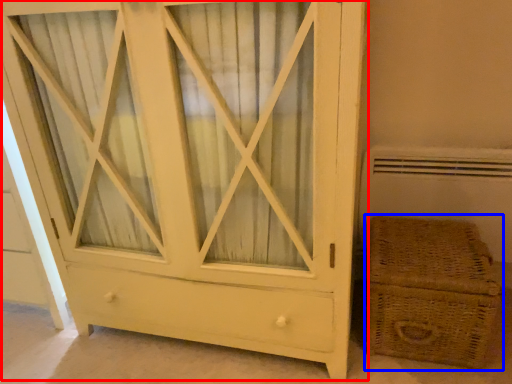
Question: Which point is further to the camera, chest of drawers (highlighted by a red box) or basket (highlighted by a blue box)?

Choices:
 (A) chest of drawers
 (B) basket

Answer: (B)